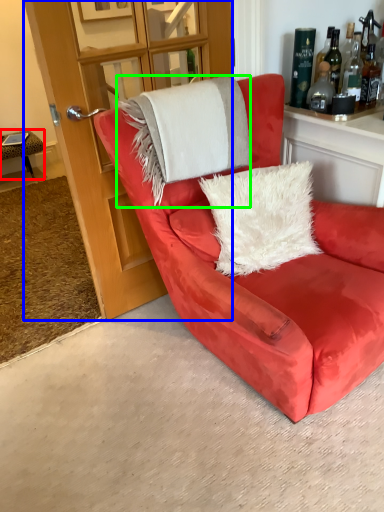
Question: Which object is positioned closest to table (highlighted by a red box)? Select from glass door (highlighted by a blue box) and blanket (highlighted by a green box).

Choices:
 (A) glass door
 (B) blanket

Answer: (A)